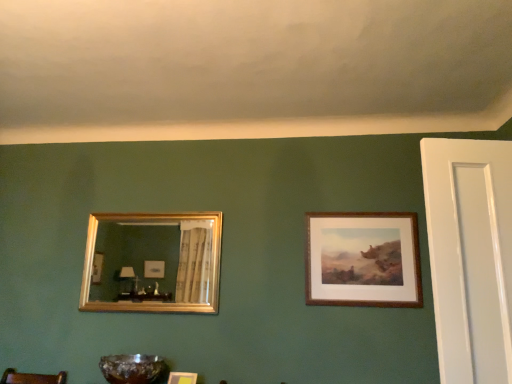
Question: Is brown wooden frame at upper right, marked as the third picture frame in a left-to-right arrangement, behind translucent amber glass bowl at lower center?

Choices:
 (A) yes
 (B) no

Answer: (A)

Question: Are brown wooden frame at upper right, the first picture frame positioned from the right, and translucent amber glass bowl at lower center beside each other?

Choices:
 (A) yes
 (B) no

Answer: (B)

Question: Does brown wooden frame at upper right, the first picture frame positioned from the right, have a lesser height compared to translucent amber glass bowl at lower center?

Choices:
 (A) no
 (B) yes

Answer: (A)

Question: Is translucent amber glass bowl at lower center at the back of brown wooden frame at upper right, the first picture frame positioned from the right?

Choices:
 (A) no
 (B) yes

Answer: (A)

Question: From the image's perspective, is brown wooden frame at upper right, marked as the third picture frame in a left-to-right arrangement, on top of translucent amber glass bowl at lower center?

Choices:
 (A) no
 (B) yes

Answer: (B)

Question: Is brown wooden frame at upper right, the first picture frame positioned from the right, not near translucent amber glass bowl at lower center?

Choices:
 (A) no
 (B) yes

Answer: (B)

Question: Considering the relative sizes of wooden picture frame at lower center, which is the 2th picture frame from left to right, and brown wooden frame at upper right, the first picture frame positioned from the right, in the image provided, is wooden picture frame at lower center, which is the 2th picture frame from left to right, taller than brown wooden frame at upper right, the first picture frame positioned from the right,?

Choices:
 (A) yes
 (B) no

Answer: (B)

Question: Is brown wooden frame at upper right, the first picture frame positioned from the right, completely or partially inside wooden picture frame at lower center, which is counted as the second picture frame, starting from the right?

Choices:
 (A) yes
 (B) no

Answer: (B)

Question: Is wooden picture frame at lower center, which is counted as the second picture frame, starting from the right, shorter than brown wooden frame at upper right, marked as the third picture frame in a left-to-right arrangement?

Choices:
 (A) no
 (B) yes

Answer: (B)

Question: Does wooden picture frame at lower center, which is the 2th picture frame from left to right, have a smaller size compared to brown wooden frame at upper right, marked as the third picture frame in a left-to-right arrangement?

Choices:
 (A) yes
 (B) no

Answer: (A)

Question: From a real-world perspective, is wooden picture frame at lower center, which is the 2th picture frame from left to right, physically below brown wooden frame at upper right, the first picture frame positioned from the right?

Choices:
 (A) yes
 (B) no

Answer: (A)

Question: Does wooden picture frame at lower center, which is the 2th picture frame from left to right, have a greater width compared to brown wooden frame at upper right, marked as the third picture frame in a left-to-right arrangement?

Choices:
 (A) yes
 (B) no

Answer: (A)

Question: Considering the relative positions of wooden picture frame at lower center, which is counted as the second picture frame, starting from the right, and gold-framed mirror at left, which is the first picture frame from left to right, in the image provided, is wooden picture frame at lower center, which is counted as the second picture frame, starting from the right, to the right of gold-framed mirror at left, which is the first picture frame from left to right, from the viewer's perspective?

Choices:
 (A) no
 (B) yes

Answer: (B)